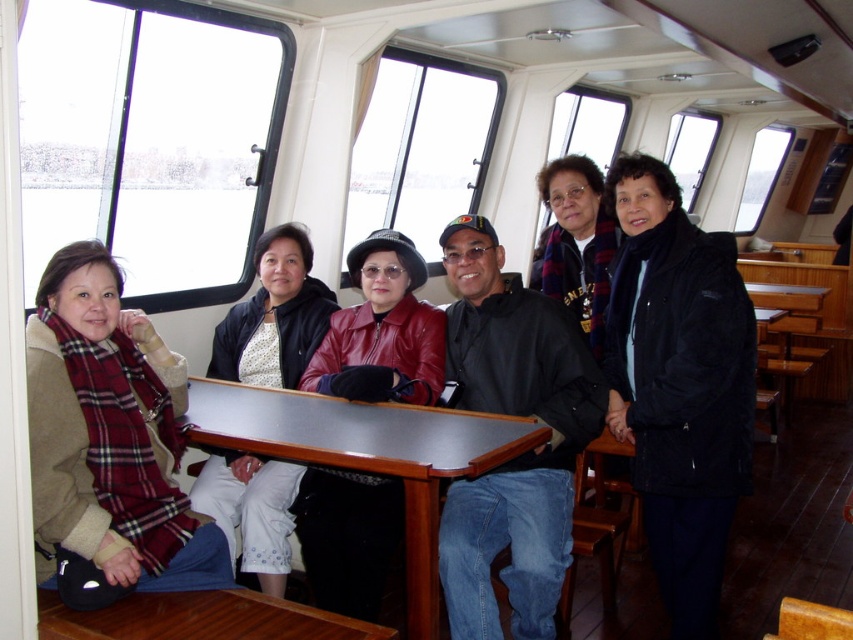
You are standing at point (473, 451) and want to move to the front of the cabin. Which direction should you move relative to point (393, 241)?

To move to the front of the cabin from point (473, 451), you should move towards point (393, 241) since it is behind your current position.

You are a photographer standing at the back of the cabin. You want to take a photo of the metallic polished table at center and the wooden table at center. Which table will appear closer to you in the photo?

The wooden table at center is behind the metallic polished table at center, so the metallic polished table at center will appear closer to you in the photo.

You are a passenger on a ferry and you want to place your luggage on the metallic polished table at center. Can you confirm the exact coordinates where the table is located?

The metallic polished table at center is located at coordinates point (x=367, y=456).